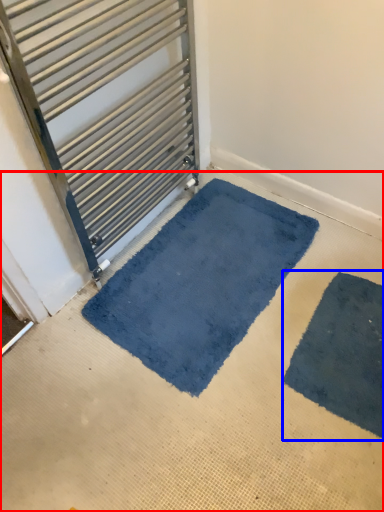
Question: Which object is closer to the camera taking this photo, concrete (highlighted by a red box) or bath mat (highlighted by a blue box)?

Choices:
 (A) concrete
 (B) bath mat

Answer: (A)